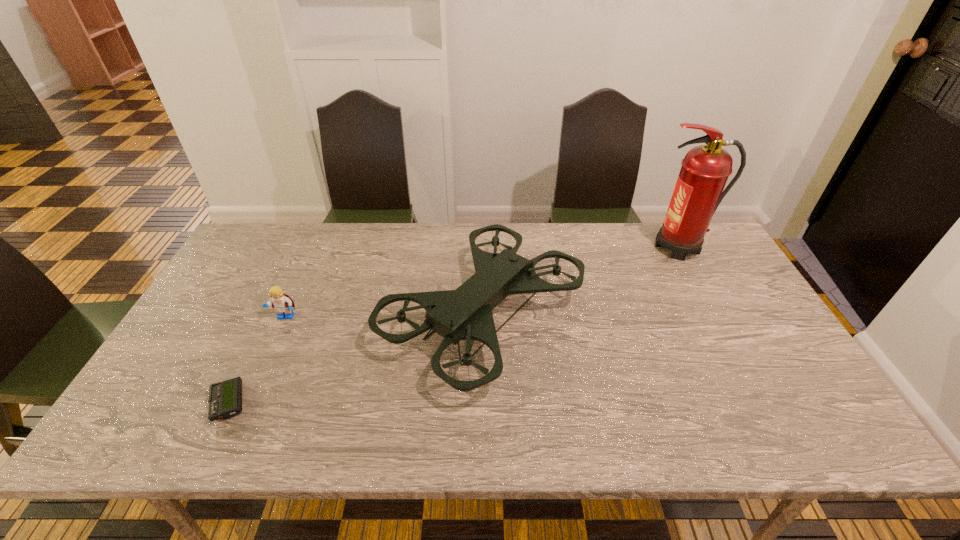
I want to click on the rightmost object, so click(x=705, y=169).

You are a GUI agent. You are given a task and a screenshot of the screen. Output one action in this format:
    pyautogui.click(x=<x>, y=<y>)
    Task: Click on the tallest object
    Image resolution: width=960 pixels, height=540 pixels.
    Given the screenshot: What is the action you would take?
    pyautogui.click(x=705, y=169)

Where is `the second tallest object`? the second tallest object is located at coordinates (464, 314).

You are a GUI agent. You are given a task and a screenshot of the screen. Output one action in this format:
    pyautogui.click(x=<x>, y=<y>)
    Task: Click on the drone
    The height and width of the screenshot is (540, 960).
    Given the screenshot: What is the action you would take?
    pyautogui.click(x=464, y=314)

You are a GUI agent. You are given a task and a screenshot of the screen. Output one action in this format:
    pyautogui.click(x=<x>, y=<y>)
    Task: Click on the Lego
    The height and width of the screenshot is (540, 960).
    Given the screenshot: What is the action you would take?
    (282, 303)

The image size is (960, 540). In order to click on beeper in this screenshot , I will do `click(225, 398)`.

Where is `blank space located 0.400m on the front-facing side of the rightmost object`? The height and width of the screenshot is (540, 960). blank space located 0.400m on the front-facing side of the rightmost object is located at coordinates (524, 247).

This screenshot has height=540, width=960. Find the location of `vacant space situated 0.070m on the front-facing side of the rightmost object`. vacant space situated 0.070m on the front-facing side of the rightmost object is located at coordinates (623, 247).

Find the location of a particular element. The width and height of the screenshot is (960, 540). free region located 0.170m on the front-facing side of the rightmost object is located at coordinates (593, 247).

Where is `vacant space located 0.150m on the left of the third object from left to right`? vacant space located 0.150m on the left of the third object from left to right is located at coordinates (327, 315).